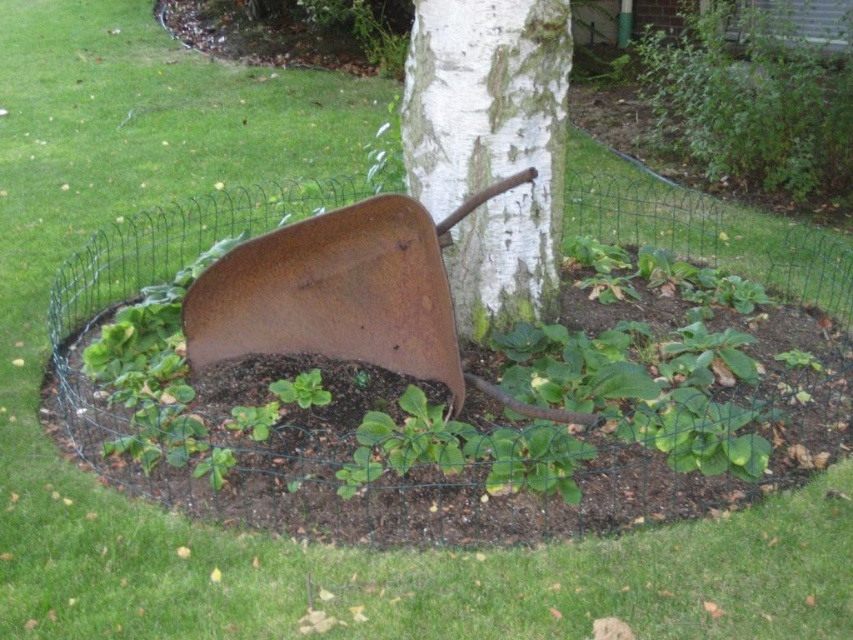
Question: Observing the image, what is the correct spatial positioning of white rough bark tree at center in reference to rusty metal shovel at center?

Choices:
 (A) left
 (B) right

Answer: (B)

Question: Can you confirm if white rough bark tree at center is positioned to the right of rusty metal shovel at center?

Choices:
 (A) yes
 (B) no

Answer: (A)

Question: Does white rough bark tree at center lie behind rusty metal shovel at center?

Choices:
 (A) yes
 (B) no

Answer: (A)

Question: Which point is farther to the camera?

Choices:
 (A) (428, 353)
 (B) (489, 22)

Answer: (A)